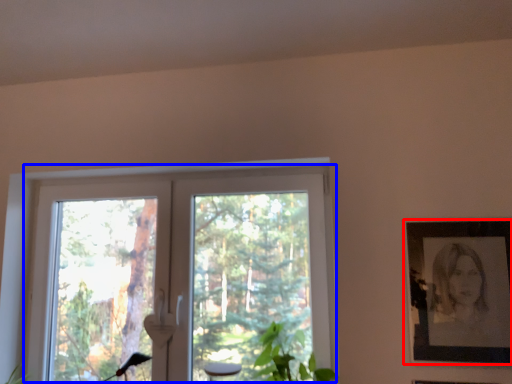
Question: Among these objects, which one is farthest to the camera, picture frame (highlighted by a red box) or window (highlighted by a blue box)?

Choices:
 (A) picture frame
 (B) window

Answer: (B)